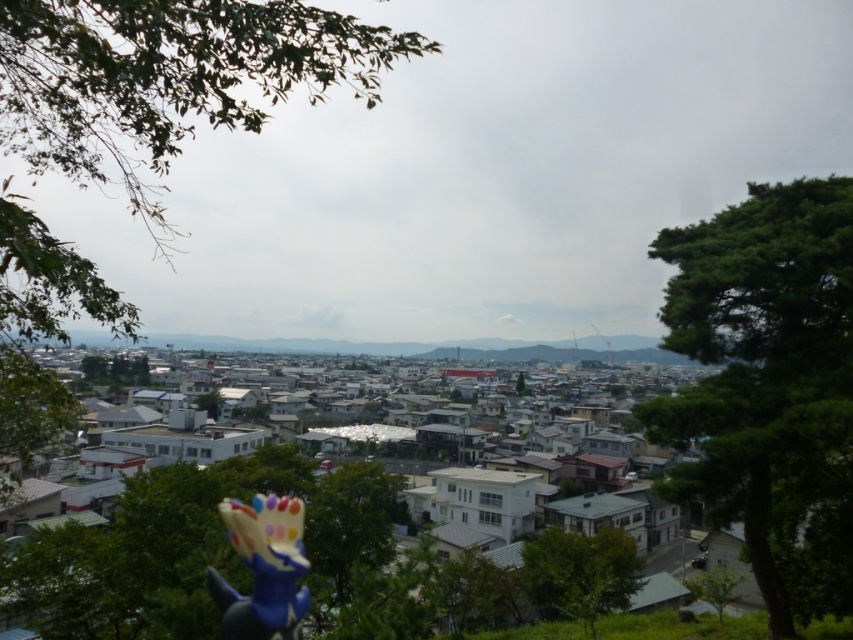
You are standing at the point marked by the coordinates point (x=166, y=77) in the residential area. Which direction should you walk to reach the green leafy tree at upper left?

The point (x=166, y=77) already indicates the location of the green leafy tree at upper left, so you are already at the tree.

You are standing at the base of the green leafy tree at lower center and want to look up towards the green leafy tree at right. In which direction should you look?

You should look upward because the green leafy tree at right is located above the green leafy tree at lower center.

You are a bird flying over a suburban area and want to land on the tallest tree. Which tree should you choose between the green leafy tree at upper left and the green leafy tree at center?

The green leafy tree at upper left is taller than the green leafy tree at center, so you should choose the green leafy tree at upper left to land on.